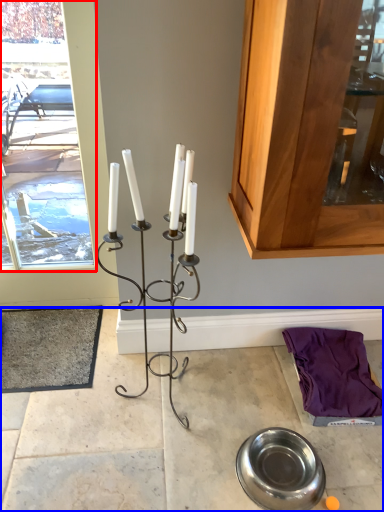
Question: Among these objects, which one is farthest to the camera, window frame (highlighted by a red box) or concrete (highlighted by a blue box)?

Choices:
 (A) window frame
 (B) concrete

Answer: (A)